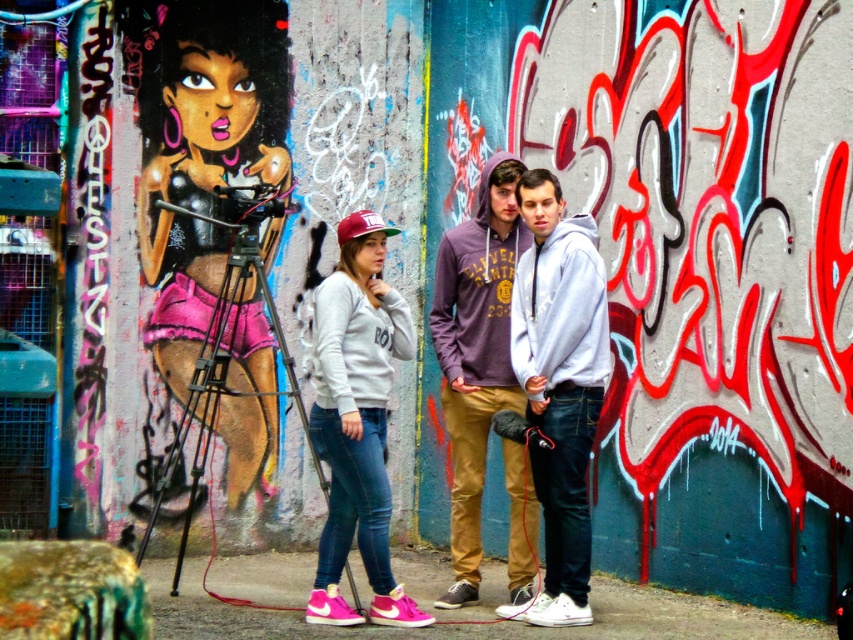
You are a photographer trying to capture a photo of the graffiti art in the alleyway. You notice two people in the frame wearing shiny pink shorts at left and a matte purple hoodie at center. To ensure both are in the shot, where should you position your camera relative to the graffiti wall?

Position your camera to the right side of the graffiti wall so that both the shiny pink shorts at left and the matte purple hoodie at center are included in the frame. Since the shiny pink shorts at left are to the left of the matte purple hoodie at center, placing the camera to the right will ensure both are visible.

You are a photographer trying to capture both the matte gray hoodie at center and the white fleece hoodie at center in a single shot. Since you want to ensure both are fully visible, which hoodie should you focus on first to avoid cropping the taller one out of the frame?

The matte gray hoodie at center is taller than the white fleece hoodie at center, so you should focus on including the matte gray hoodie at center first to ensure it fits entirely within the frame.

You are a photographer trying to capture a photo of the graffiti art in the alleyway. You notice two people wearing hoodies in the foreground. The light gray hoodie at center and the matte purple hoodie at center are blocking your view. Which hoodie is shorter and might be easier to crouch behind to get a clear shot of the graffiti?

The light gray hoodie at center is not as tall as the matte purple hoodie at center, so it is shorter and might be easier to crouch behind to get a clear shot of the graffiti.